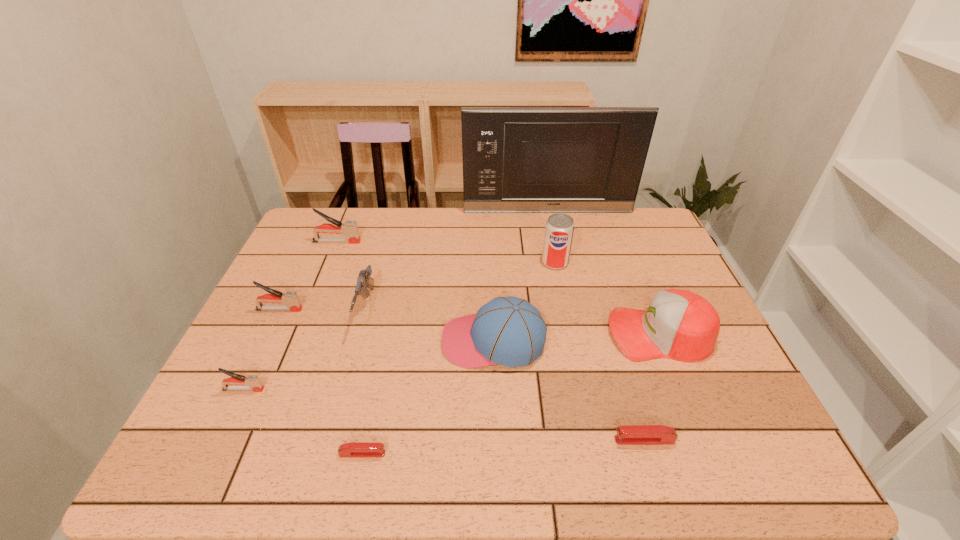
In order to click on the farthest object in this screenshot , I will do `click(515, 159)`.

You are a GUI agent. You are given a task and a screenshot of the screen. Output one action in this format:
    pyautogui.click(x=<x>, y=<y>)
    Task: Click on the microwave oven
    This screenshot has width=960, height=540.
    Given the screenshot: What is the action you would take?
    pyautogui.click(x=515, y=159)

Where is `the eighth nearest object`? This screenshot has height=540, width=960. the eighth nearest object is located at coordinates (559, 229).

Find the location of `soda`. soda is located at coordinates (559, 229).

What are the coordinates of `the ninth nearest object` in the screenshot? It's located at (349, 228).

Where is `the farthest gray stapler`? The image size is (960, 540). the farthest gray stapler is located at coordinates (349, 228).

The image size is (960, 540). I want to click on the left baseball cap, so click(509, 331).

Identify the location of the right baseball cap. (681, 325).

Locate an element on the screen. the fourth object from left to right is located at coordinates (364, 281).

The height and width of the screenshot is (540, 960). What are the coordinates of `the fourth nearest stapler` in the screenshot? It's located at (290, 298).